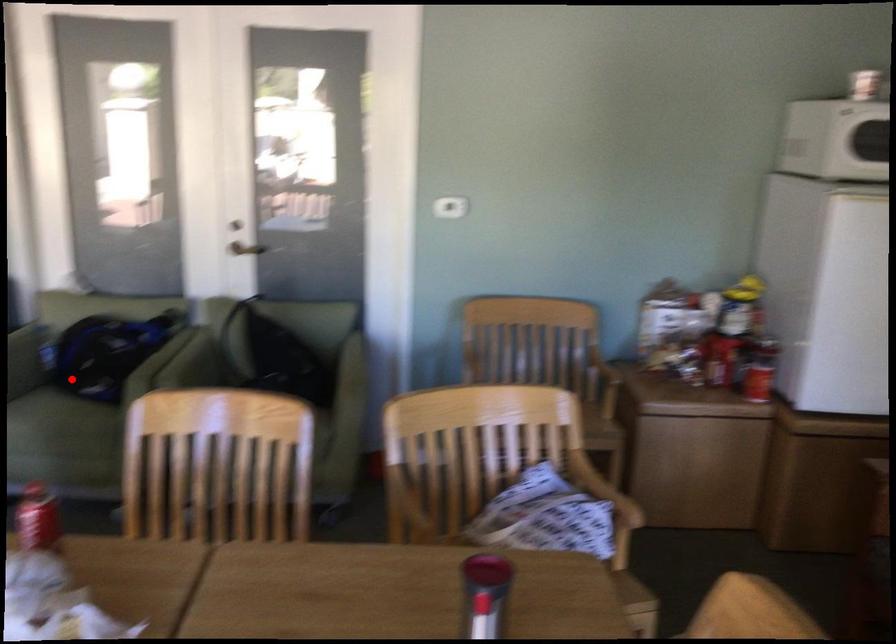
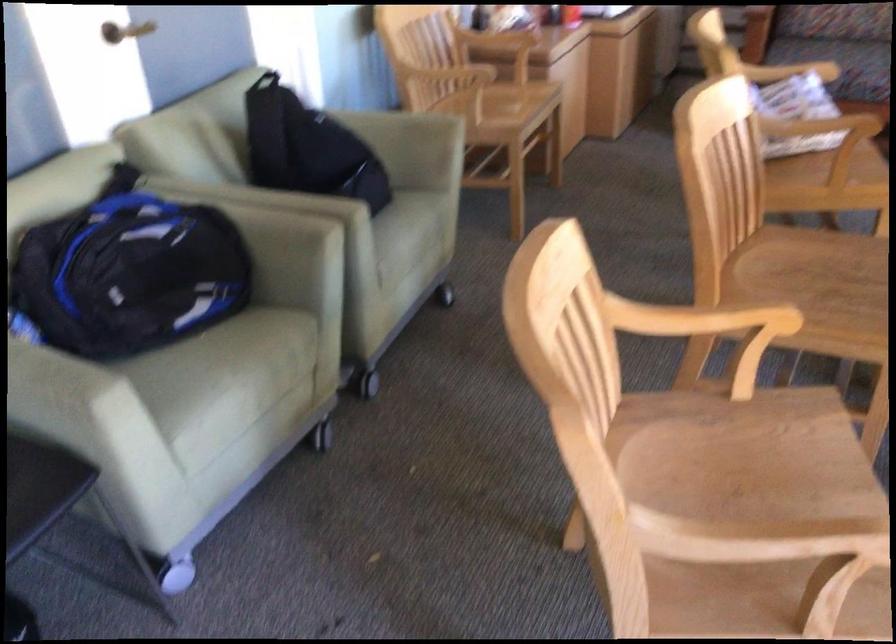
Question: I am providing you with two images of the same scene from different viewpoints. A red point is shown in image1. For the corresponding object point in image2, is it positioned nearer or farther from the camera?

Choices:
 (A) Nearer
 (B) Farther

Answer: (A)